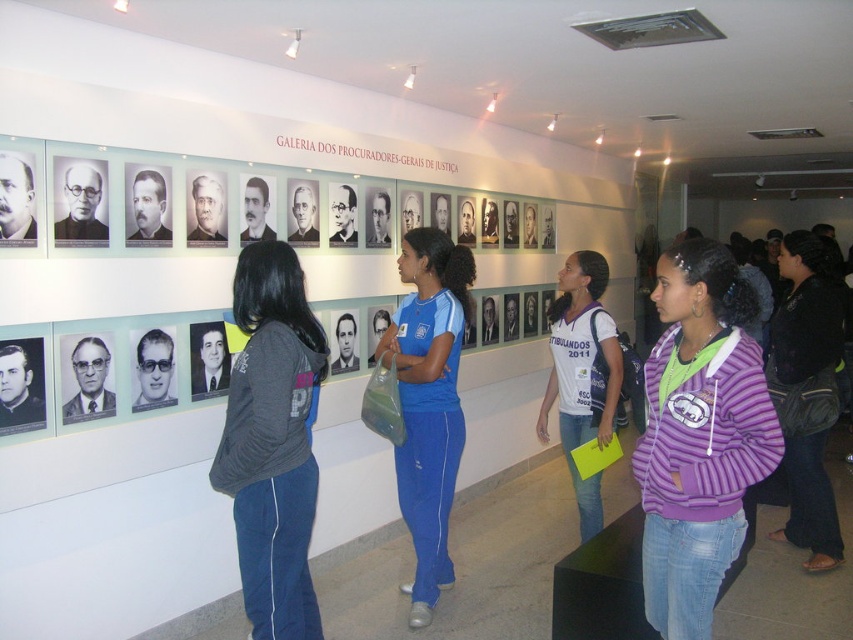
Which is in front, point (271, 604) or point (572, 284)?

Point (271, 604)

Describe the element at coordinates (271, 442) in the screenshot. I see `dark gray hoodie at center` at that location.

This screenshot has height=640, width=853. What are the coordinates of `dark gray hoodie at center` in the screenshot? It's located at (271, 442).

Does purple striped hoodie at lower right have a greater height compared to dark gray hoodie at center?

No, purple striped hoodie at lower right is not taller than dark gray hoodie at center.

Consider the image. Does purple striped hoodie at lower right have a lesser width compared to dark gray hoodie at center?

Correct, purple striped hoodie at lower right's width is less than dark gray hoodie at center's.

Is point (706, 515) closer to camera compared to point (299, 522)?

Yes, it is in front of point (299, 522).

You are a GUI agent. You are given a task and a screenshot of the screen. Output one action in this format:
    pyautogui.click(x=<x>, y=<y>)
    Task: Click on the purple striped hoodie at lower right
    Image resolution: width=853 pixels, height=640 pixels.
    Given the screenshot: What is the action you would take?
    pyautogui.click(x=699, y=435)

The height and width of the screenshot is (640, 853). Describe the element at coordinates (805, 394) in the screenshot. I see `black leather bag at right` at that location.

Can you confirm if black leather bag at right is thinner than purple fleece jacket at center?

No, black leather bag at right is not thinner than purple fleece jacket at center.

Is point (824, 531) farther from camera compared to point (595, 513)?

Yes, it is behind point (595, 513).

The width and height of the screenshot is (853, 640). I want to click on black leather bag at right, so click(x=805, y=394).